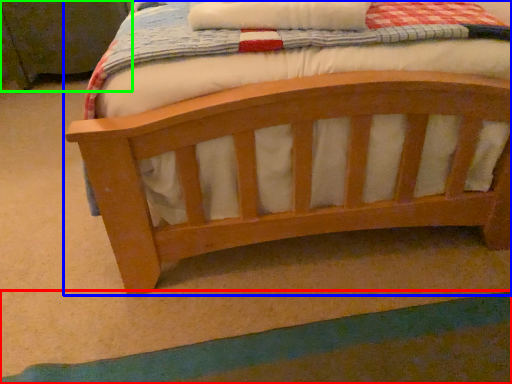
Question: Which object is positioned closest to strip (highlighted by a red box)? Select from bed (highlighted by a blue box) and changing table (highlighted by a green box).

Choices:
 (A) bed
 (B) changing table

Answer: (A)